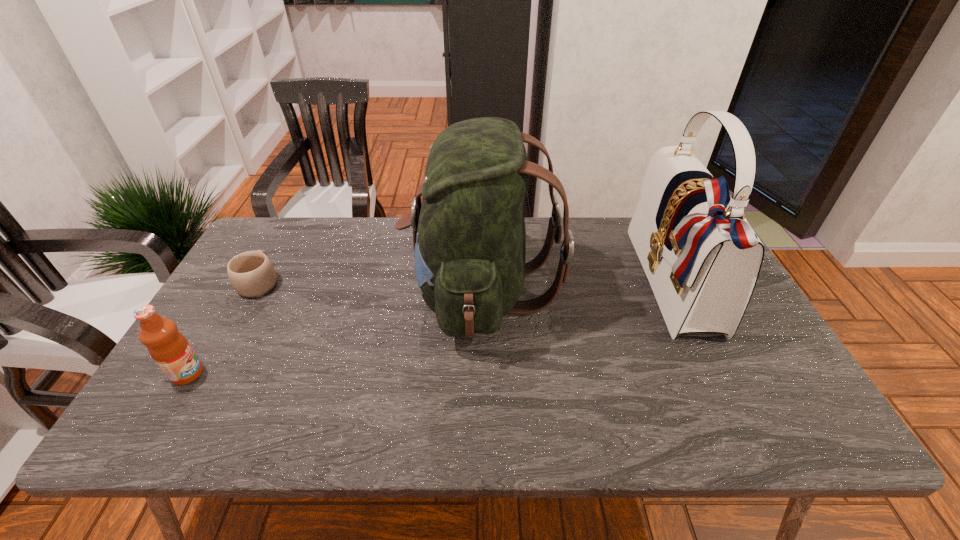
The image size is (960, 540). What are the coordinates of `the rightmost object` in the screenshot? It's located at (702, 258).

At what (x,y) coordinates should I click in order to perform the action: click on the second object from right to left. Please return your answer as a coordinate pair (x, y). This screenshot has height=540, width=960. Looking at the image, I should click on (469, 236).

Find the location of a particular element. The image size is (960, 540). the second shortest object is located at coordinates (168, 347).

The image size is (960, 540). I want to click on the shortest object, so click(252, 274).

This screenshot has width=960, height=540. What are the coordinates of `vacant region located 0.290m on the front-facing side of the rightmost object` in the screenshot? It's located at (542, 284).

This screenshot has height=540, width=960. Find the location of `free space located 0.160m on the front-facing side of the rightmost object`. free space located 0.160m on the front-facing side of the rightmost object is located at coordinates (588, 284).

What are the coordinates of `free space located 0.140m on the front-facing side of the rightmost object` in the screenshot? It's located at (594, 284).

What are the coordinates of `vacant space positioned on the open flap of the backpack` in the screenshot? It's located at (348, 292).

I want to click on free point located 0.330m on the open flap of the backpack, so click(289, 292).

Locate an element on the screen. The image size is (960, 540). vacant point located 0.060m on the open flap of the backpack is located at coordinates (384, 292).